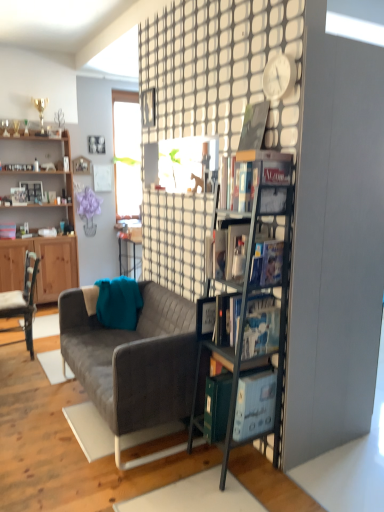
Describe the element at coordinates (118, 303) in the screenshot. This screenshot has height=512, width=384. I see `teal fabric pillow at center` at that location.

What do you see at coordinates (261, 326) in the screenshot? I see `hardcover book at center, which is counted as the 1th book, starting from the bottom` at bounding box center [261, 326].

This screenshot has width=384, height=512. What do you see at coordinates (278, 77) in the screenshot? I see `white plastic clock at upper center` at bounding box center [278, 77].

Where is `wooden cabinet at left, the 2th shelf from the front`? wooden cabinet at left, the 2th shelf from the front is located at coordinates (38, 181).

The width and height of the screenshot is (384, 512). What are the coordinates of `purple fabric plant at upper center` in the screenshot? It's located at (88, 209).

The width and height of the screenshot is (384, 512). Identify the location of hardcover book at upper right, the 1th book when ordered from top to bottom. (254, 126).

From the image's perspective, is wooden chair at left on top of metallic gray bookshelf at center-right, arranged as the 1th shelf when viewed from the right?

No, from the image's perspective, wooden chair at left is not above metallic gray bookshelf at center-right, arranged as the 1th shelf when viewed from the right.

Based on the photo, which object is further away from the camera, wooden chair at left or metallic gray bookshelf at center-right, positioned as the 2th shelf in back-to-front order?

wooden chair at left is further away from the camera.

In order to click on shelf that is on the right side of wooden chair at left in this screenshot , I will do `click(258, 291)`.

Is wooden chair at left directly adjacent to metallic gray bookshelf at center-right, placed as the second shelf when sorted from left to right?

No, wooden chair at left is not making contact with metallic gray bookshelf at center-right, placed as the second shelf when sorted from left to right.

In terms of size, does metallic gray bookshelf at center-right, arranged as the 1th shelf when viewed from the front, appear bigger or smaller than matte black picture frame at upper center, positioned as the 1th picture frame in top-to-bottom order?

Considering their sizes, metallic gray bookshelf at center-right, arranged as the 1th shelf when viewed from the front, takes up more space than matte black picture frame at upper center, positioned as the 1th picture frame in top-to-bottom order.

Does metallic gray bookshelf at center-right, positioned as the 2th shelf in back-to-front order, have a lesser height compared to matte black picture frame at upper center, positioned as the 1th picture frame in top-to-bottom order?

No.

From the image's perspective, would you say metallic gray bookshelf at center-right, arranged as the 1th shelf when viewed from the right, is shown under matte black picture frame at upper center, positioned as the 1th picture frame in top-to-bottom order?

Yes.

Considering their positions, is wooden chair at left located in front of or behind wooden cabinet at left, the 2th shelf from the front?

Clearly, wooden chair at left is in front of wooden cabinet at left, the 2th shelf from the front.

Does point (3, 332) come behind point (0, 181)?

No, it is in front of (0, 181).

In terms of width, does wooden chair at left look wider or thinner when compared to wooden cabinet at left, the 2th shelf from the front?

In the image, wooden chair at left appears to be wider than wooden cabinet at left, the 2th shelf from the front.

Are wooden chair at left and wooden cabinet at left, which is the first shelf in left-to-right order, far apart?

That's right, there is a large distance between wooden chair at left and wooden cabinet at left, which is the first shelf in left-to-right order.

Measure the distance from purple fabric plant at upper center to matte black book at upper right, the 3th book positioned from the bottom.

purple fabric plant at upper center and matte black book at upper right, the 3th book positioned from the bottom, are 4.27 meters apart.

From the image's perspective, is purple fabric plant at upper center located above or below matte black book at upper right, the 3th book positioned from the bottom?

purple fabric plant at upper center is situated higher than matte black book at upper right, the 3th book positioned from the bottom, in the image.

Can matte black book at upper right, which is counted as the second book, starting from the top, be found inside purple fabric plant at upper center?

No, matte black book at upper right, which is counted as the second book, starting from the top, is not inside purple fabric plant at upper center.

Which is behind, matte black picture frame at upper center, positioned as the 1th picture frame in top-to-bottom order, or purple fabric plant at upper center?

Positioned behind is matte black picture frame at upper center, positioned as the 1th picture frame in top-to-bottom order.

Considering the relative sizes of matte black picture frame at upper center, positioned as the 1th picture frame in top-to-bottom order, and purple fabric plant at upper center in the image provided, is matte black picture frame at upper center, positioned as the 1th picture frame in top-to-bottom order, wider than purple fabric plant at upper center?

No, matte black picture frame at upper center, positioned as the 1th picture frame in top-to-bottom order, is not wider than purple fabric plant at upper center.

Considering the sizes of objects matte black picture frame at upper center, which appears as the third picture frame when ordered from the bottom, and purple fabric plant at upper center in the image provided, who is bigger, matte black picture frame at upper center, which appears as the third picture frame when ordered from the bottom, or purple fabric plant at upper center?

With larger size is purple fabric plant at upper center.

Find the location of `picture frame that is the 3rd one when counting upward from the purple fabric plant at upper center (from the image's perspective)`. picture frame that is the 3rd one when counting upward from the purple fabric plant at upper center (from the image's perspective) is located at coordinates (96, 144).

Considering the relative sizes of wooden picture frame at upper left, marked as the second picture frame in a bottom-to-top arrangement, and textured gray couch at center in the image provided, is wooden picture frame at upper left, marked as the second picture frame in a bottom-to-top arrangement, bigger than textured gray couch at center?

Actually, wooden picture frame at upper left, marked as the second picture frame in a bottom-to-top arrangement, might be smaller than textured gray couch at center.

From the image's perspective, between wooden picture frame at upper left, the second picture frame from the top, and textured gray couch at center, who is located below?

textured gray couch at center, from the image's perspective.

Considering the relative sizes of wooden picture frame at upper left, marked as the second picture frame in a bottom-to-top arrangement, and textured gray couch at center in the image provided, is wooden picture frame at upper left, marked as the second picture frame in a bottom-to-top arrangement, shorter than textured gray couch at center?

Yes.

Find the location of a particular element. studio couch located underneath the wooden picture frame at upper left, the second picture frame from the top (from a real-world perspective) is located at coordinates (133, 362).

Can you see wooden chair at left touching teal fabric pillow at center?

They are not placed beside each other.

From the image's perspective, which is below, wooden chair at left or teal fabric pillow at center?

From the image's view, wooden chair at left is below.

Is wooden chair at left facing away from teal fabric pillow at center?

No.

Can we say wooden chair at left lies outside teal fabric pillow at center?

Yes, wooden chair at left is outside of teal fabric pillow at center.

Find the location of a particular element. the 1st shelf positioned above the wooden chair at left (from the image's perspective) is located at coordinates (258, 291).

This screenshot has height=512, width=384. Identify the location of shelf that is the 2nd one when counting downward from the matte black picture frame at upper center, which appears as the third picture frame when ordered from the bottom (from the image's perspective). (258, 291).

From the image, which object appears to be farther from textured gray couch at center, wooden cabinet at left, which ranks as the 2th shelf in right-to-left order, or metallic gray bookshelf at center-right, placed as the second shelf when sorted from left to right?

wooden cabinet at left, which ranks as the 2th shelf in right-to-left order, lies further to textured gray couch at center than the other object.

From the image, which object appears to be nearer to wooden picture frame at upper left, the second picture frame from the top, teal fabric pillow at center or hardcover book at center, which is the 3th book from top to bottom?

Among the two, teal fabric pillow at center is located nearer to wooden picture frame at upper left, the second picture frame from the top.

Looking at the image, which one is located further to wooden chair at left, white matte picture frame at upper center, which ranks as the 3th picture frame in top-to-bottom order, or white plastic clock at upper center?

white matte picture frame at upper center, which ranks as the 3th picture frame in top-to-bottom order, lies further to wooden chair at left than the other object.

When comparing their distances from textured gray couch at center, does white plastic clock at upper center or hardcover book at center, the 4th book viewed from the top, seem closer?

hardcover book at center, the 4th book viewed from the top.

Based on their spatial positions, is wooden picture frame at upper left, the second picture frame from the top, or teal fabric pillow at center closer to white plastic clock at upper center?

Among the two, teal fabric pillow at center is located nearer to white plastic clock at upper center.

Looking at the image, which one is located closer to white matte picture frame at upper center, which ranks as the 3th picture frame in top-to-bottom order, textured gray couch at center or hardcover book at center, the 2th book when ordered from bottom to top?

textured gray couch at center.

Which object lies further to the anchor point purple fabric plant at upper center, wooden picture frame at upper left, the second picture frame from the top, or white matte picture frame at upper center, which ranks as the 3th picture frame in top-to-bottom order?

The object further to purple fabric plant at upper center is wooden picture frame at upper left, the second picture frame from the top.

From the image, which object appears to be farther from wooden chair at left, wooden cabinet at left, the 2th shelf from the front, or purple fabric plant at upper center?

Based on the image, purple fabric plant at upper center appears to be further to wooden chair at left.

The image size is (384, 512). Identify the location of pillow between wooden chair at left and hardcover book at center, the 2th book when ordered from bottom to top, from left to right. (118, 303).

Locate an element on the screen. pillow between white plastic clock at upper center and wooden cabinet at left, the first shelf from the back, in the front-back direction is located at coordinates (118, 303).

The height and width of the screenshot is (512, 384). I want to click on studio couch between matte black book at upper right, which is counted as the second book, starting from the top, and white matte picture frame at upper center, the 1th picture frame positioned from the bottom, in the front-back direction, so click(x=133, y=362).

Identify the location of chair between textured gray couch at center and purple fabric plant at upper center from front to back. The height and width of the screenshot is (512, 384). (22, 301).